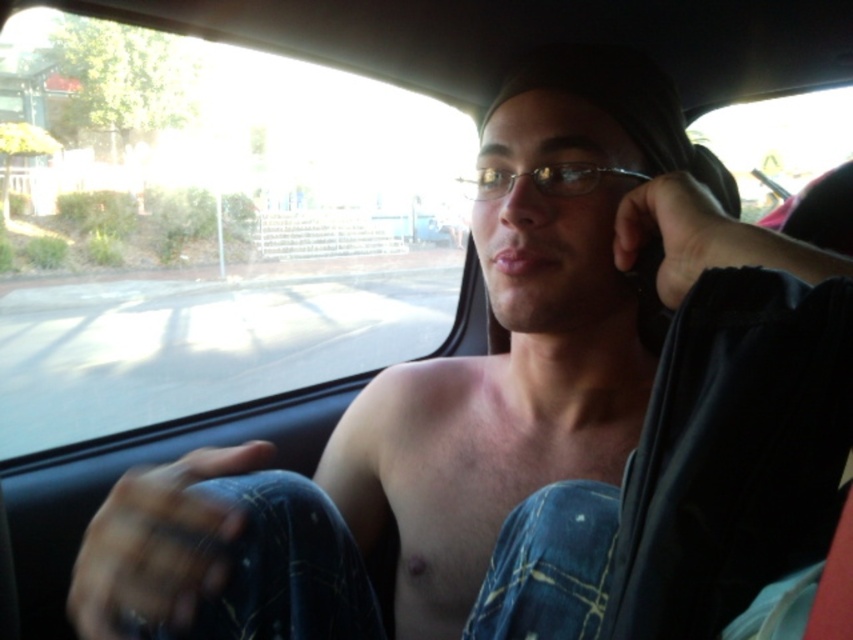
Question: Is transparent glass car window at upper left bigger than transparent glass car window at upper center?

Choices:
 (A) yes
 (B) no

Answer: (A)

Question: Does transparent glass car window at upper left appear under transparent glass car window at upper center?

Choices:
 (A) no
 (B) yes

Answer: (B)

Question: Where is transparent glass car window at upper left located in relation to transparent glass car window at upper center in the image?

Choices:
 (A) below
 (B) above

Answer: (A)